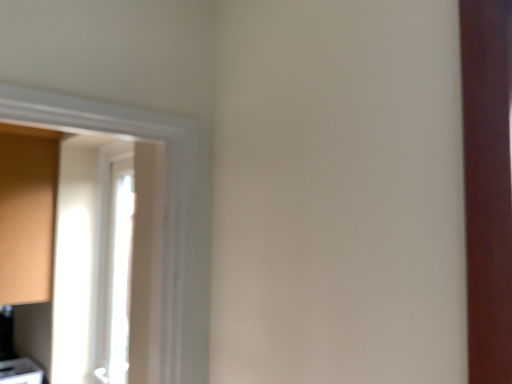
The width and height of the screenshot is (512, 384). In order to click on matte wood cabinet at left, which ranks as the 1th cabinetry in top-to-bottom order in this screenshot , I will do `click(27, 212)`.

What do you see at coordinates (102, 265) in the screenshot? The image size is (512, 384). I see `white glossy door at left` at bounding box center [102, 265].

The height and width of the screenshot is (384, 512). In order to click on matte white cabinet at lower left, placed as the 1th cabinetry when sorted from bottom to top in this screenshot , I will do `click(20, 372)`.

Which point is more forward, (120, 318) or (20, 364)?

Point (120, 318)

From the image's perspective, which object appears higher, white glossy door at left or matte white cabinet at lower left, the second cabinetry positioned from the top?

From the image's view, white glossy door at left is above.

Can you confirm if white glossy door at left is positioned to the left of matte white cabinet at lower left, placed as the 1th cabinetry when sorted from bottom to top?

In fact, white glossy door at left is to the right of matte white cabinet at lower left, placed as the 1th cabinetry when sorted from bottom to top.

Can matte white cabinet at lower left, placed as the 1th cabinetry when sorted from bottom to top, be found inside white glossy door at left?

No, matte white cabinet at lower left, placed as the 1th cabinetry when sorted from bottom to top, is not surrounded by white glossy door at left.

Would you say white glossy door at left is outside matte wood cabinet at left, which ranks as the 1th cabinetry in top-to-bottom order?

Indeed, white glossy door at left is completely outside matte wood cabinet at left, which ranks as the 1th cabinetry in top-to-bottom order.

Does white glossy door at left appear on the left side of matte wood cabinet at left, placed as the second cabinetry when sorted from bottom to top?

In fact, white glossy door at left is to the right of matte wood cabinet at left, placed as the second cabinetry when sorted from bottom to top.

From the picture: Which is nearer, (75, 339) or (30, 256)?

Point (75, 339) is farther from the camera than point (30, 256).

Is matte wood cabinet at left, which ranks as the 1th cabinetry in top-to-bottom order, not close to white glossy door at left?

That's not correct — matte wood cabinet at left, which ranks as the 1th cabinetry in top-to-bottom order, is a little close to white glossy door at left.

Is point (22, 191) farther from camera compared to point (40, 361)?

That is False.

Which object is thinner, matte wood cabinet at left, placed as the second cabinetry when sorted from bottom to top, or white glossy door at left?

white glossy door at left.

Is white glossy door at left surrounded by matte wood cabinet at left, which ranks as the 1th cabinetry in top-to-bottom order?

That's incorrect, white glossy door at left is not inside matte wood cabinet at left, which ranks as the 1th cabinetry in top-to-bottom order.

Measure the distance from matte wood cabinet at left, placed as the second cabinetry when sorted from bottom to top, to matte white cabinet at lower left, the second cabinetry positioned from the top.

matte wood cabinet at left, placed as the second cabinetry when sorted from bottom to top, and matte white cabinet at lower left, the second cabinetry positioned from the top, are 26.50 inches apart from each other.

Which point is more forward, (42, 200) or (4, 362)?

Point (42, 200)

Does matte wood cabinet at left, placed as the second cabinetry when sorted from bottom to top, come in front of matte white cabinet at lower left, placed as the 1th cabinetry when sorted from bottom to top?

Yes, matte wood cabinet at left, placed as the second cabinetry when sorted from bottom to top, is closer to the viewer.

Image resolution: width=512 pixels, height=384 pixels. Find the location of `cabinetry on the right side of matte wood cabinet at left, placed as the second cabinetry when sorted from bottom to top`. cabinetry on the right side of matte wood cabinet at left, placed as the second cabinetry when sorted from bottom to top is located at coordinates point(20,372).

Considering the sizes of matte white cabinet at lower left, the second cabinetry positioned from the top, and matte wood cabinet at left, placed as the second cabinetry when sorted from bottom to top, in the image, is matte white cabinet at lower left, the second cabinetry positioned from the top, wider or thinner than matte wood cabinet at left, placed as the second cabinetry when sorted from bottom to top,?

In the image, matte white cabinet at lower left, the second cabinetry positioned from the top, appears to be more narrow than matte wood cabinet at left, placed as the second cabinetry when sorted from bottom to top.

Which is in front, point (6, 361) or point (16, 165)?

Point (16, 165)

In terms of size, does matte white cabinet at lower left, the second cabinetry positioned from the top, appear bigger or smaller than matte wood cabinet at left, which ranks as the 1th cabinetry in top-to-bottom order?

Clearly, matte white cabinet at lower left, the second cabinetry positioned from the top, is smaller in size than matte wood cabinet at left, which ranks as the 1th cabinetry in top-to-bottom order.

Is matte white cabinet at lower left, placed as the 1th cabinetry when sorted from bottom to top, not within matte wood cabinet at left, which ranks as the 1th cabinetry in top-to-bottom order?

matte white cabinet at lower left, placed as the 1th cabinetry when sorted from bottom to top, lies outside matte wood cabinet at left, which ranks as the 1th cabinetry in top-to-bottom order,'s area.

Is point (11, 369) behind point (41, 314)?

No, (11, 369) is closer to viewer.

This screenshot has width=512, height=384. Find the location of `window screen located above the matte white cabinet at lower left, the second cabinetry positioned from the top (from the image's perspective)`. window screen located above the matte white cabinet at lower left, the second cabinetry positioned from the top (from the image's perspective) is located at coordinates (102, 265).

From the image's perspective, is matte white cabinet at lower left, placed as the 1th cabinetry when sorted from bottom to top, over white glossy door at left?

No, from the image's perspective, matte white cabinet at lower left, placed as the 1th cabinetry when sorted from bottom to top, is not above white glossy door at left.

You are a GUI agent. You are given a task and a screenshot of the screen. Output one action in this format:
    pyautogui.click(x=<x>, y=<y>)
    Task: Click on the window screen above the matte white cabinet at lower left, the second cabinetry positioned from the top (from the image's perspective)
    This screenshot has width=512, height=384.
    Given the screenshot: What is the action you would take?
    pos(102,265)

The height and width of the screenshot is (384, 512). Find the location of `the 1st cabinetry behind when counting from the white glossy door at left`. the 1st cabinetry behind when counting from the white glossy door at left is located at coordinates (27, 212).

Estimate the real-world distances between objects in this image. Which object is closer to matte white cabinet at lower left, the second cabinetry positioned from the top, matte wood cabinet at left, which ranks as the 1th cabinetry in top-to-bottom order, or white glossy door at left?

white glossy door at left lies closer to matte white cabinet at lower left, the second cabinetry positioned from the top, than the other object.

Based on their spatial positions, is matte white cabinet at lower left, the second cabinetry positioned from the top, or white glossy door at left further from matte wood cabinet at left, placed as the second cabinetry when sorted from bottom to top?

The object further to matte wood cabinet at left, placed as the second cabinetry when sorted from bottom to top, is matte white cabinet at lower left, the second cabinetry positioned from the top.

Considering their positions, is matte white cabinet at lower left, placed as the 1th cabinetry when sorted from bottom to top, positioned further to white glossy door at left than matte wood cabinet at left, which ranks as the 1th cabinetry in top-to-bottom order?

matte white cabinet at lower left, placed as the 1th cabinetry when sorted from bottom to top, is positioned further to the anchor white glossy door at left.

When comparing their distances from white glossy door at left, does matte wood cabinet at left, which ranks as the 1th cabinetry in top-to-bottom order, or matte white cabinet at lower left, the second cabinetry positioned from the top, seem closer?

matte wood cabinet at left, which ranks as the 1th cabinetry in top-to-bottom order, is positioned closer to the anchor white glossy door at left.

Considering their positions, is white glossy door at left positioned further to matte white cabinet at lower left, placed as the 1th cabinetry when sorted from bottom to top, than matte wood cabinet at left, placed as the second cabinetry when sorted from bottom to top?

matte wood cabinet at left, placed as the second cabinetry when sorted from bottom to top.

Which object lies nearer to the anchor point matte wood cabinet at left, which ranks as the 1th cabinetry in top-to-bottom order, white glossy door at left or matte white cabinet at lower left, placed as the 1th cabinetry when sorted from bottom to top?

Among the two, white glossy door at left is located nearer to matte wood cabinet at left, which ranks as the 1th cabinetry in top-to-bottom order.

I want to click on window screen between matte wood cabinet at left, placed as the second cabinetry when sorted from bottom to top, and matte white cabinet at lower left, placed as the 1th cabinetry when sorted from bottom to top, in the up-down direction, so click(x=102, y=265).